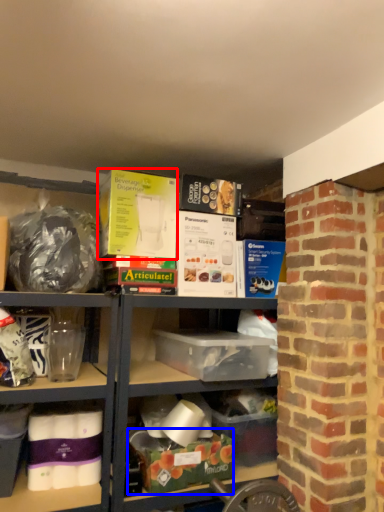
Question: Which object is closer to the camera taking this photo, box (highlighted by a red box) or box (highlighted by a blue box)?

Choices:
 (A) box
 (B) box

Answer: (B)